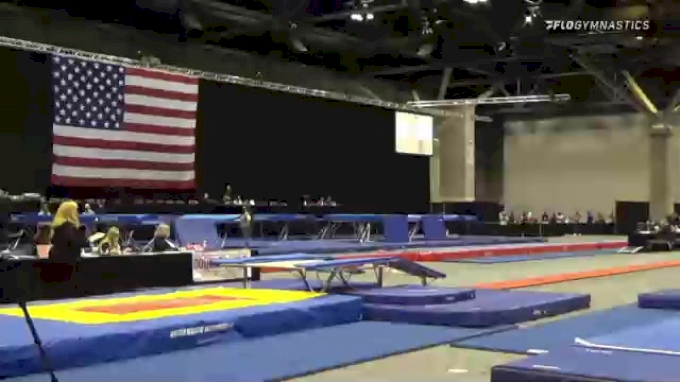
The image size is (680, 382). Identify the location of orange mats. click(600, 272).